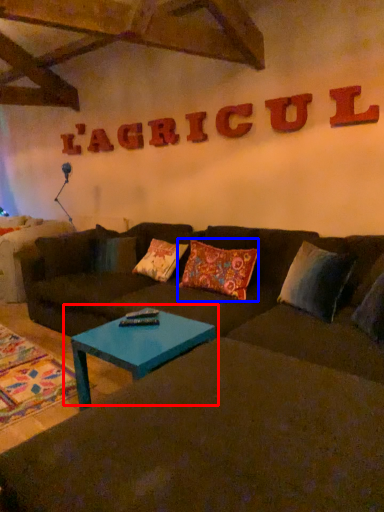
Question: Which object is closer to the camera taking this photo, coffee table (highlighted by a red box) or pillow (highlighted by a blue box)?

Choices:
 (A) coffee table
 (B) pillow

Answer: (A)